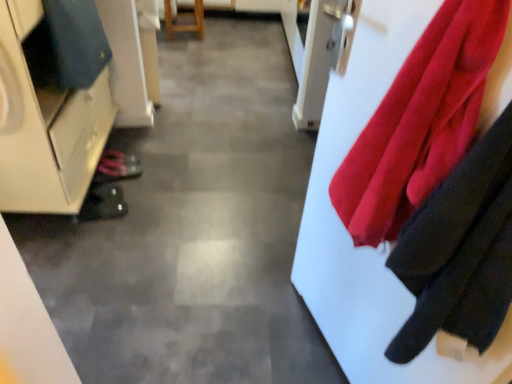
Question: Is velvety red cloth at right inside the boundaries of matte white cabinet at left, or outside?

Choices:
 (A) outside
 (B) inside

Answer: (A)

Question: Does point (336, 203) appear closer or farther from the camera than point (14, 117)?

Choices:
 (A) farther
 (B) closer

Answer: (B)

Question: Based on their relative distances, which object is farther from the shiny black shoe at lower left, placed as the 1th shoe when sorted from back to front?

Choices:
 (A) wooden stool at center
 (B) matte white cabinet at left
 (C) dark blue fabric at left
 (D) velvety red cloth at right
 (E) black rubber shoe at lower left, which ranks as the first shoe in bottom-to-top order

Answer: (A)

Question: Which is farther from the shiny black shoe at lower left, the 1th shoe positioned from the top?

Choices:
 (A) wooden stool at center
 (B) matte white cabinet at left
 (C) dark blue fabric at left
 (D) black rubber shoe at lower left, which ranks as the first shoe in bottom-to-top order
 (E) velvety red cloth at right

Answer: (A)